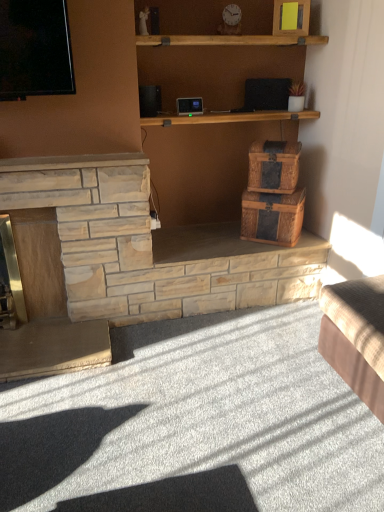
What do you see at coordinates (274, 166) in the screenshot? I see `woven brown crate at center-right` at bounding box center [274, 166].

The image size is (384, 512). What do you see at coordinates (272, 217) in the screenshot? I see `woven wood chest at center` at bounding box center [272, 217].

At what (x,y) coordinates should I click in order to perform the action: click on natural stone fireplace at left. Please return your answer as a coordinate pair (x, y). Looking at the image, I should click on (80, 254).

Locate an element on the screen. Image resolution: width=384 pixels, height=512 pixels. woven brown crate at center-right is located at coordinates (274, 166).

Relative to woven brown crate at center-right, is woven wood chest at center in front or behind?

woven wood chest at center is behind woven brown crate at center-right.

From a real-world perspective, is woven wood chest at center located beneath woven brown crate at center-right?

Yes, from a real-world perspective, woven wood chest at center is beneath woven brown crate at center-right.

Looking at this image, is woven wood chest at center aimed at woven brown crate at center-right?

No, woven wood chest at center is not oriented towards woven brown crate at center-right.

Which is less distant, (296, 195) or (265, 191)?

Point (296, 195)

Looking at the image, does beige fabric couch at lower right seem bigger or smaller compared to woven wood chest at center?

Clearly, beige fabric couch at lower right is larger in size than woven wood chest at center.

Is beige fabric couch at lower right inside the boundaries of woven wood chest at center, or outside?

The correct answer is: outside.

Is beige fabric couch at lower right taller or shorter than woven wood chest at center?

Clearly, beige fabric couch at lower right is taller compared to woven wood chest at center.

Are woven wood chest at center and natural stone fireplace at left beside each other?

No, woven wood chest at center is not making contact with natural stone fireplace at left.

Is woven wood chest at center oriented away from natural stone fireplace at left?

woven wood chest at center is not turned away from natural stone fireplace at left.

Which is farther from the camera, (274, 218) or (56, 325)?

The point (274, 218) is behind.

Is woven wood chest at center in front of natural stone fireplace at left?

No, woven wood chest at center is further to the viewer.

Does natural stone fireplace at left appear on the left side of beige fabric couch at lower right?

Correct, you'll find natural stone fireplace at left to the left of beige fabric couch at lower right.

From their relative heights in the image, would you say natural stone fireplace at left is taller or shorter than beige fabric couch at lower right?

Considering their sizes, natural stone fireplace at left has more height than beige fabric couch at lower right.

Where is `studio couch below the natural stone fireplace at left (from a real-world perspective)`? studio couch below the natural stone fireplace at left (from a real-world perspective) is located at coordinates (356, 337).

Is natural stone fireplace at left far away from beige fabric couch at lower right?

Indeed, natural stone fireplace at left is not near beige fabric couch at lower right.

Considering the relative positions of woven brown crate at center-right and beige fabric couch at lower right in the image provided, is woven brown crate at center-right to the right of beige fabric couch at lower right from the viewer's perspective?

Incorrect, woven brown crate at center-right is not on the right side of beige fabric couch at lower right.

Based on the photo, is beige fabric couch at lower right at the back of woven brown crate at center-right?

No.

Considering the sizes of objects woven brown crate at center-right and beige fabric couch at lower right in the image provided, who is taller, woven brown crate at center-right or beige fabric couch at lower right?

With more height is beige fabric couch at lower right.

From a real-world perspective, does woven brown crate at center-right stand above beige fabric couch at lower right?

Yes, from a real-world perspective, woven brown crate at center-right is on top of beige fabric couch at lower right.

Based on the photo, is natural stone fireplace at left outside of woven wood chest at center?

natural stone fireplace at left lies outside woven wood chest at center's area.

From the image's perspective, between natural stone fireplace at left and woven wood chest at center, which one is located above?

woven wood chest at center is shown above in the image.

Consider the image. Is woven wood chest at center at the back of natural stone fireplace at left?

That's not correct — natural stone fireplace at left is not looking away from woven wood chest at center.

Identify the location of fireplace below the woven wood chest at center (from a real-world perspective). Image resolution: width=384 pixels, height=512 pixels. point(80,254).

Is beige fabric couch at lower right completely or partially outside of natural stone fireplace at left?

Absolutely, beige fabric couch at lower right is external to natural stone fireplace at left.

Is beige fabric couch at lower right taller or shorter than natural stone fireplace at left?

Considering their sizes, beige fabric couch at lower right has less height than natural stone fireplace at left.

Between beige fabric couch at lower right and natural stone fireplace at left, which one has larger size?

natural stone fireplace at left.

From a real-world perspective, is beige fabric couch at lower right physically below natural stone fireplace at left?

Correct, in the physical world, beige fabric couch at lower right is lower than natural stone fireplace at left.

The image size is (384, 512). Identify the location of crate in front of the woven wood chest at center. (274, 166).

Image resolution: width=384 pixels, height=512 pixels. What are the coordinates of `drawer on the left of beige fabric couch at lower right` in the screenshot? It's located at (272, 217).

Based on their spatial positions, is beige fabric couch at lower right or woven wood chest at center further from woven brown crate at center-right?

The object further to woven brown crate at center-right is beige fabric couch at lower right.

Based on their spatial positions, is beige fabric couch at lower right or woven brown crate at center-right further from woven wood chest at center?

beige fabric couch at lower right is further to woven wood chest at center.

Consider the image. Which object lies nearer to the anchor point natural stone fireplace at left, woven wood chest at center or woven brown crate at center-right?

Among the two, woven wood chest at center is located nearer to natural stone fireplace at left.

Considering their positions, is natural stone fireplace at left positioned closer to woven brown crate at center-right than woven wood chest at center?

Based on the image, woven wood chest at center appears to be nearer to woven brown crate at center-right.

Considering their positions, is natural stone fireplace at left positioned closer to beige fabric couch at lower right than woven wood chest at center?

Among the two, woven wood chest at center is located nearer to beige fabric couch at lower right.

Estimate the real-world distances between objects in this image. Which object is further from woven brown crate at center-right, woven wood chest at center or beige fabric couch at lower right?

beige fabric couch at lower right is positioned further to the anchor woven brown crate at center-right.

Based on their spatial positions, is woven wood chest at center or natural stone fireplace at left closer to beige fabric couch at lower right?

Among the two, woven wood chest at center is located nearer to beige fabric couch at lower right.

From the image, which object appears to be nearer to woven brown crate at center-right, beige fabric couch at lower right or natural stone fireplace at left?

The object closer to woven brown crate at center-right is beige fabric couch at lower right.

The width and height of the screenshot is (384, 512). What are the coordinates of `crate located between natural stone fireplace at left and beige fabric couch at lower right in the left-right direction` in the screenshot? It's located at (274, 166).

Locate an element on the screen. crate situated between natural stone fireplace at left and woven wood chest at center from left to right is located at coordinates (274, 166).

The height and width of the screenshot is (512, 384). I want to click on drawer that lies between woven brown crate at center-right and beige fabric couch at lower right from top to bottom, so click(x=272, y=217).

I want to click on drawer between natural stone fireplace at left and beige fabric couch at lower right from left to right, so click(272, 217).